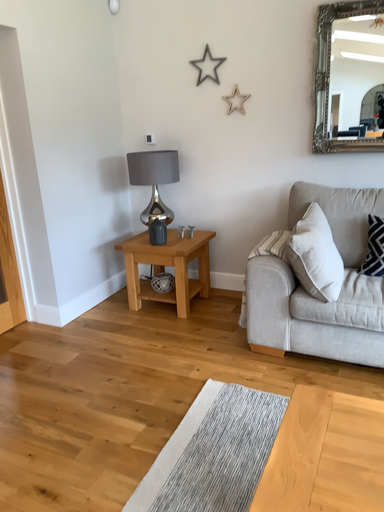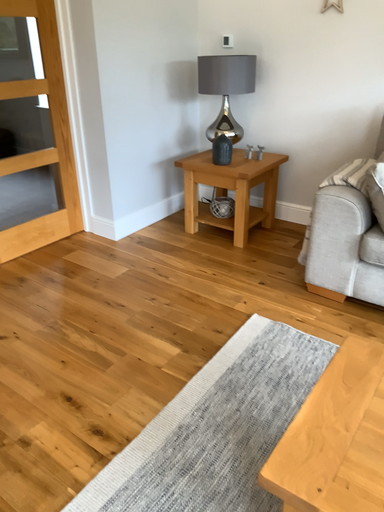
Question: Which way did the camera rotate in the video?

Choices:
 (A) rotated right
 (B) rotated left

Answer: (B)